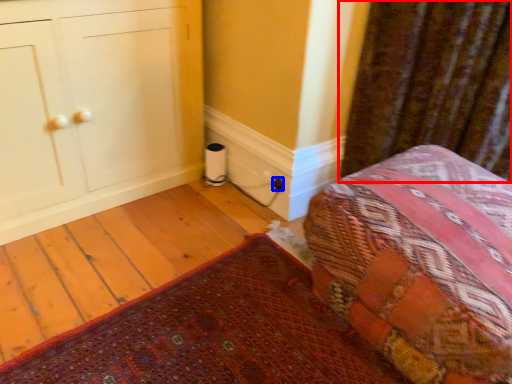
Question: Among these objects, which one is farthest to the camera, curtain (highlighted by a red box) or electric outlet (highlighted by a blue box)?

Choices:
 (A) curtain
 (B) electric outlet

Answer: (B)